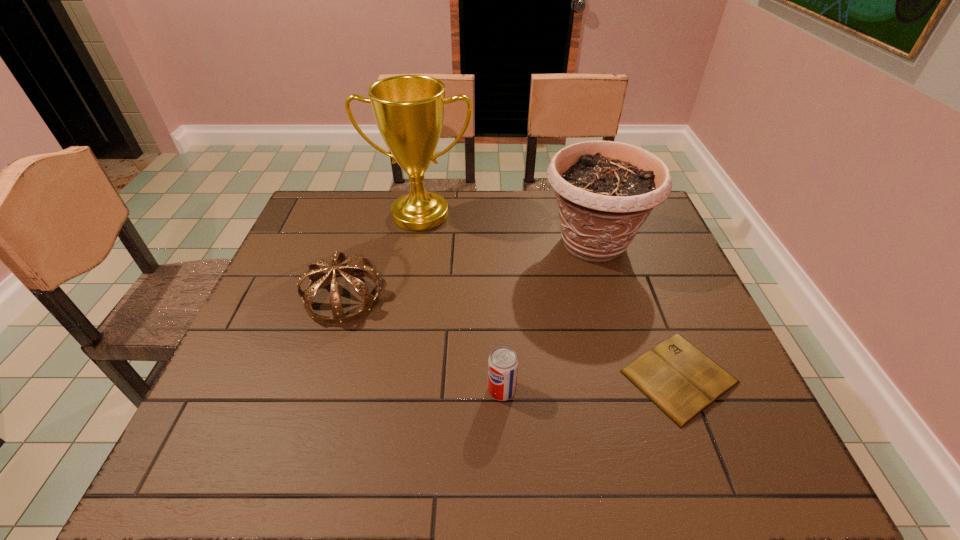
Image resolution: width=960 pixels, height=540 pixels. What are the coordinates of `free space at the right edge of the desktop` in the screenshot? It's located at (654, 251).

In order to click on blank area at the far right corner in this screenshot , I will do `click(652, 227)`.

Identify the location of free space that is in between the book and the flowerpot. Image resolution: width=960 pixels, height=540 pixels. (636, 310).

Where is `free space between the shortest object and the second shortest object`? free space between the shortest object and the second shortest object is located at coordinates (590, 383).

Find the location of `free spot between the award and the tiara`. free spot between the award and the tiara is located at coordinates (382, 256).

I want to click on vacant point located between the tiara and the soda, so click(x=422, y=343).

Locate an element on the screen. empty location between the flowerpot and the award is located at coordinates (507, 230).

Identify the location of free space between the second tallest object and the tiara. (468, 271).

Identify the location of vacant area between the tallest object and the book. The height and width of the screenshot is (540, 960). (550, 296).

Locate an element on the screen. This screenshot has height=540, width=960. vacant area between the third object from right to left and the flowerpot is located at coordinates (547, 317).